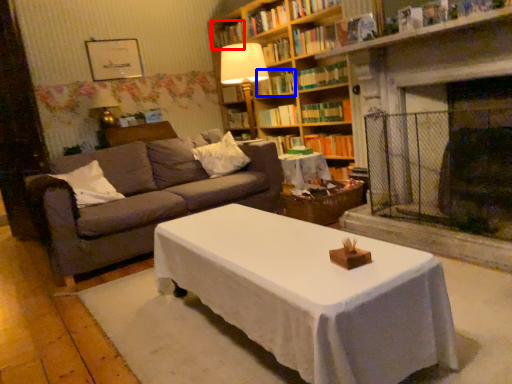
Question: Among these objects, which one is farthest to the camera, book (highlighted by a red box) or book (highlighted by a blue box)?

Choices:
 (A) book
 (B) book

Answer: (A)